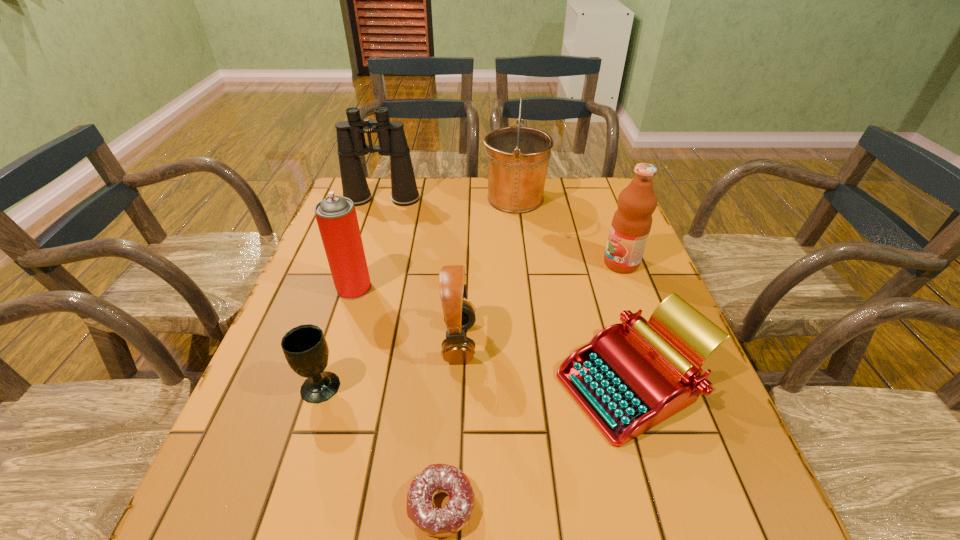
Image resolution: width=960 pixels, height=540 pixels. What are the coordinates of `free spot between the fruit juice and the bucket` in the screenshot? It's located at (568, 231).

Where is `free point between the bucket and the fruit juice`? Image resolution: width=960 pixels, height=540 pixels. free point between the bucket and the fruit juice is located at coordinates click(x=568, y=231).

Where is `free space between the fourth farthest object and the fifth tallest object`? free space between the fourth farthest object and the fifth tallest object is located at coordinates (407, 315).

The height and width of the screenshot is (540, 960). Find the location of `free space between the bucket and the fruit juice`. free space between the bucket and the fruit juice is located at coordinates (568, 231).

The width and height of the screenshot is (960, 540). Identify the location of free area in between the fifth nearest object and the binoculars. (368, 244).

Identify the location of vacant area that lies between the binoculars and the headset. (420, 271).

Locate which object ranks third in proximity to the aerosol can. Please provide its 2D coordinates. Your answer should be formatted as a tuple, i.e. [(x, y)], where the tuple contains the x and y coordinates of a point satisfying the conditions above.

[(351, 142)]

Where is `object that can be found as the third closest to the fruit juice`? object that can be found as the third closest to the fruit juice is located at coordinates (459, 315).